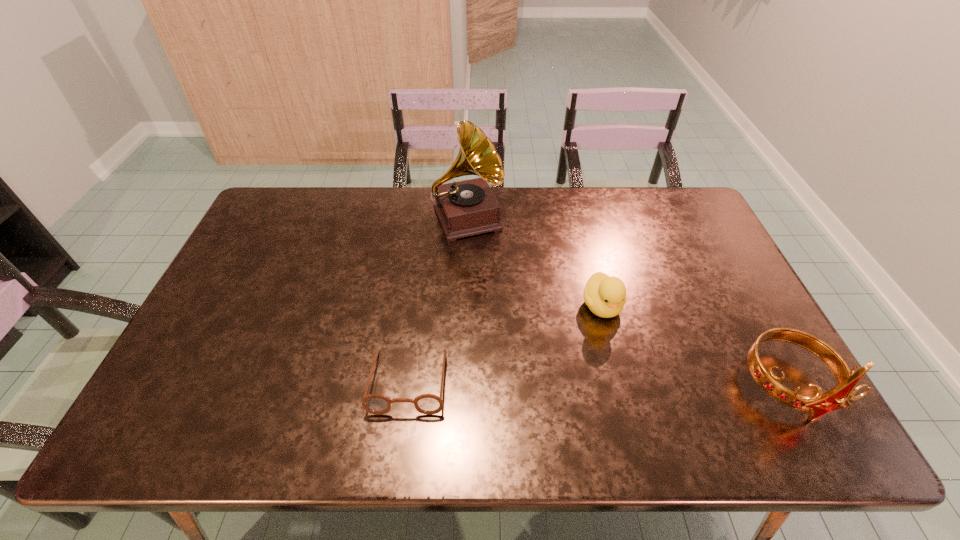
Find the location of a particular element. The image size is (960, 540). free location located 0.140m on the front-facing side of the third nearest object is located at coordinates click(x=633, y=371).

The image size is (960, 540). Find the location of `vacant area situated on the front-facing side of the third nearest object`. vacant area situated on the front-facing side of the third nearest object is located at coordinates (646, 400).

Where is `free spot located 0.210m on the front-facing side of the third nearest object`? This screenshot has height=540, width=960. free spot located 0.210m on the front-facing side of the third nearest object is located at coordinates (645, 396).

This screenshot has height=540, width=960. Find the location of `object that is at the far edge`. object that is at the far edge is located at coordinates (464, 208).

Find the location of a particular element. Image resolution: width=960 pixels, height=540 pixels. spectacles present at the near edge is located at coordinates (429, 404).

Where is `tiara present at the near edge`? This screenshot has width=960, height=540. tiara present at the near edge is located at coordinates (819, 404).

The height and width of the screenshot is (540, 960). I want to click on object located in the right edge section of the desktop, so click(819, 404).

Where is `object that is at the near right corner`? object that is at the near right corner is located at coordinates (819, 404).

At what (x,y) coordinates should I click in order to perform the action: click on vacant region at the far edge of the desktop. Please return your answer as a coordinate pair (x, y). Looking at the image, I should click on (380, 228).

At what (x,y) coordinates should I click in order to perform the action: click on blank space at the near edge of the desktop. Please return your answer as a coordinate pair (x, y). Looking at the image, I should click on (x=516, y=400).